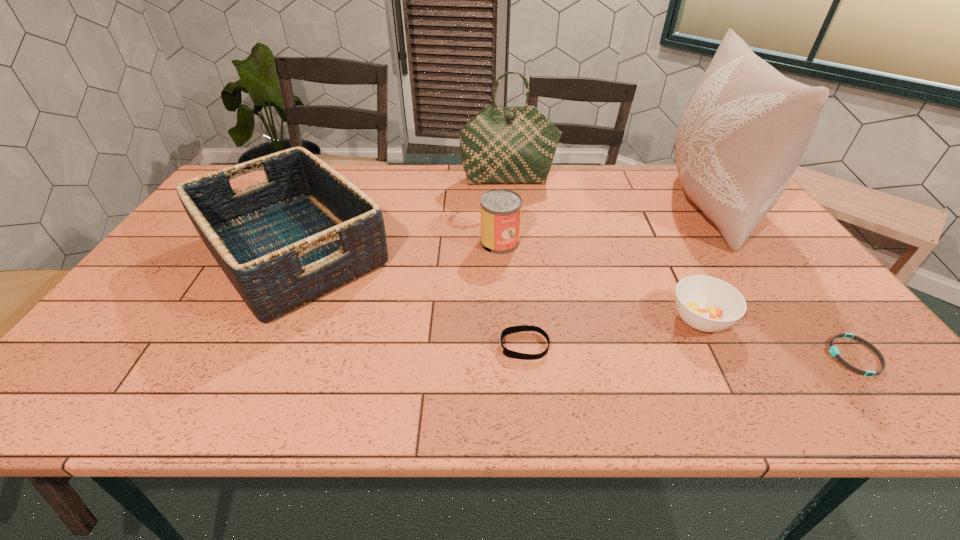
This screenshot has height=540, width=960. What are the coordinates of `free space between the shortest object and the cushion` in the screenshot? It's located at (780, 281).

The height and width of the screenshot is (540, 960). What are the coordinates of `free spot between the second tallest object and the fifth tallest object` in the screenshot? It's located at (604, 249).

Identify the location of free space between the sixth shortest object and the tallest object. The height and width of the screenshot is (540, 960). (608, 193).

What are the coordinates of `vacant area that lies between the fifth shortest object and the shortest object` in the screenshot? It's located at (574, 303).

The width and height of the screenshot is (960, 540). Identify the location of free area in between the taller wristband and the tallest object. (615, 276).

Identify the location of free point between the left wristband and the fourth shortest object. Image resolution: width=960 pixels, height=540 pixels. (512, 294).

Where is `vacant space that's between the sixth shortest object and the soup bowl`? The width and height of the screenshot is (960, 540). vacant space that's between the sixth shortest object and the soup bowl is located at coordinates (604, 249).

You are a GUI agent. You are given a task and a screenshot of the screen. Output one action in this format:
    pyautogui.click(x=<x>, y=<y>)
    Task: Click on the closest object to the basket
    The image size is (960, 540).
    Given the screenshot: What is the action you would take?
    pyautogui.click(x=500, y=145)

Locate which object ranks in proximity to the sixth shortest object. Please provide its 2D coordinates. Your answer should be formatted as a tuple, i.e. [(x, y)], where the tuple contains the x and y coordinates of a point satisfying the conditions above.

[(304, 231)]

Where is `free space that satisfies the following two spatial constraints: 1. on the back side of the leftmost object; 2. on the left side of the tote bag`? free space that satisfies the following two spatial constraints: 1. on the back side of the leftmost object; 2. on the left side of the tote bag is located at coordinates (329, 180).